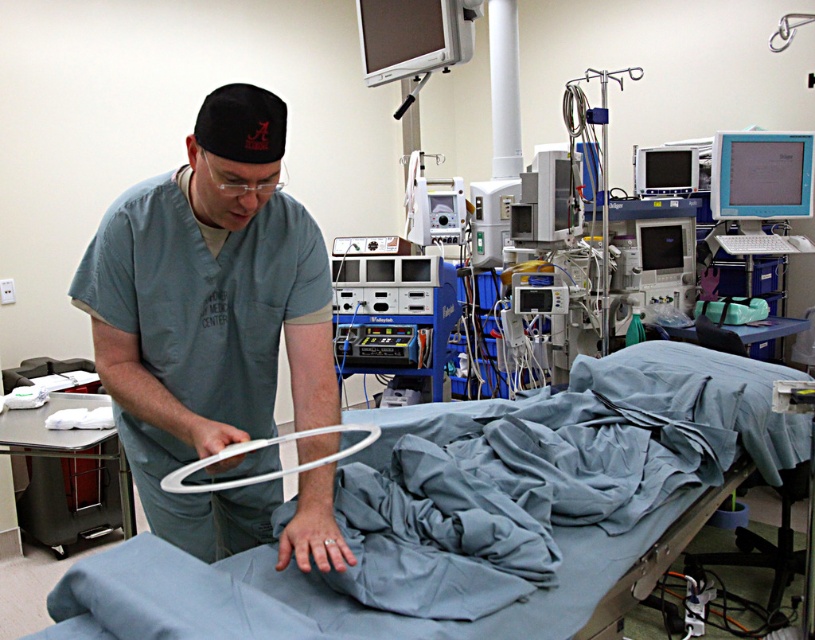
Question: In this image, where is gray matte scrubs at center located relative to white plastic ring at center?

Choices:
 (A) right
 (B) left

Answer: (B)

Question: Estimate the real-world distances between objects in this image. Which object is closer to the smooth blue fabric at center?

Choices:
 (A) white plastic ring at center
 (B) gray matte scrubs at center

Answer: (A)

Question: Among these objects, which one is farthest from the camera?

Choices:
 (A) white plastic ring at center
 (B) smooth blue fabric at center
 (C) gray matte scrubs at center

Answer: (C)

Question: Considering the real-world distances, which object is closest to the white plastic ring at center?

Choices:
 (A) smooth blue fabric at center
 (B) gray matte scrubs at center

Answer: (B)

Question: Does gray matte scrubs at center lie behind white plastic ring at center?

Choices:
 (A) yes
 (B) no

Answer: (A)

Question: Does smooth blue fabric at center appear under gray matte scrubs at center?

Choices:
 (A) yes
 (B) no

Answer: (A)